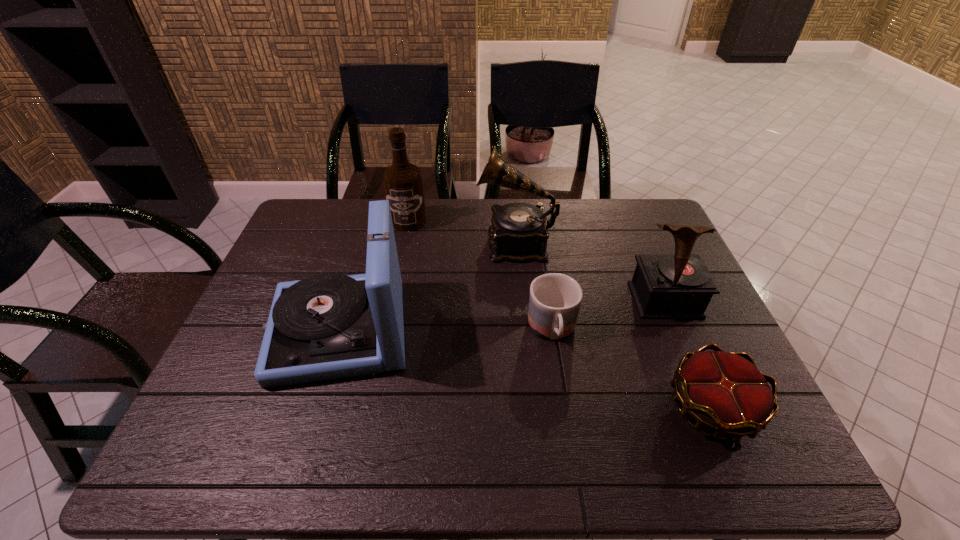
Locate an element on the screen. The height and width of the screenshot is (540, 960). object that is at the near right corner is located at coordinates (725, 392).

Where is `blank space at the far edge`? Image resolution: width=960 pixels, height=540 pixels. blank space at the far edge is located at coordinates (362, 213).

The height and width of the screenshot is (540, 960). I want to click on free location at the near edge, so click(x=499, y=451).

Find the location of a particular element. free region at the left edge is located at coordinates (221, 411).

In the image, there is a desktop. Where is `vacant space at the right edge`? vacant space at the right edge is located at coordinates (647, 246).

In the image, there is a desktop. Where is `vacant space at the far right corner`? This screenshot has width=960, height=540. vacant space at the far right corner is located at coordinates (620, 231).

Find the location of a particular element. vacant space at the near right corner of the desktop is located at coordinates (787, 456).

Where is `empty space that is in between the mug and the crown`? empty space that is in between the mug and the crown is located at coordinates (633, 369).

I want to click on vacant space that's between the leftmost phonograph_record and the rightmost phonograph_record, so click(502, 315).

The image size is (960, 540). I want to click on free spot between the leftmost phonograph_record and the second phonograph_record from right to left, so click(x=427, y=286).